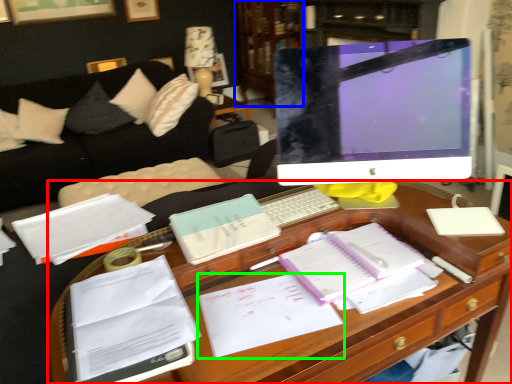
Question: Considering the real-world distances, which object is farthest from desk (highlighted by a red box)? bookshelf (highlighted by a blue box) or document (highlighted by a green box)?

Choices:
 (A) bookshelf
 (B) document

Answer: (A)